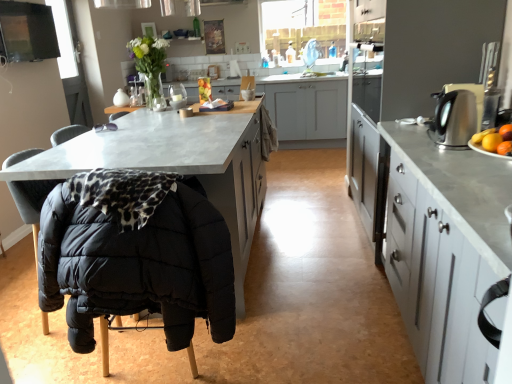
Question: Is metallic gray cabinets at right, which is counted as the 1th cabinetry, starting from the front, to the left or to the right of concrete countertop at center, the 3th cabinetry when ordered from front to back, in the image?

Choices:
 (A) left
 (B) right

Answer: (B)

Question: Is metallic gray cabinets at right, which is counted as the 1th cabinetry, starting from the front, taller or shorter than concrete countertop at center, the 3th cabinetry when ordered from front to back?

Choices:
 (A) short
 (B) tall

Answer: (A)

Question: Which of these objects is positioned closest to the black quilted fabric folding chair at lower left?

Choices:
 (A) matte gray cabinet at center, arranged as the second cabinetry when viewed from the front
 (B) satin silver kettle at right
 (C) metallic gray cabinets at right, which ranks as the third cabinetry in back-to-front order
 (D) concrete countertop at center, marked as the first cabinetry in a back-to-front arrangement

Answer: (A)

Question: Which of these objects is positioned farthest from the black quilted fabric folding chair at lower left?

Choices:
 (A) metallic gray cabinets at right, which is counted as the 1th cabinetry, starting from the front
 (B) concrete countertop at center, marked as the first cabinetry in a back-to-front arrangement
 (C) satin silver kettle at right
 (D) matte gray cabinet at center, the second cabinetry in the back-to-front sequence

Answer: (B)